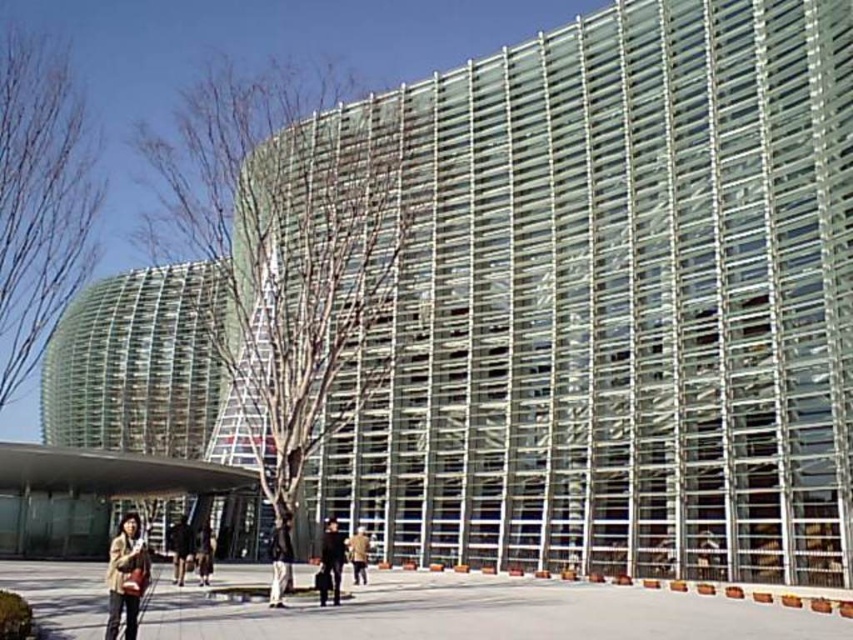
Does matte brown jacket at lower left appear over tan leather jacket at center?

Yes, matte brown jacket at lower left is above tan leather jacket at center.

How much distance is there between matte brown jacket at lower left and tan leather jacket at center?

They are 41.75 feet apart.

Measure the distance between matte brown jacket at lower left and camera.

The distance of matte brown jacket at lower left from camera is 32.52 feet.

This screenshot has height=640, width=853. Find the location of `matte brown jacket at lower left`. matte brown jacket at lower left is located at coordinates (126, 577).

Can you confirm if green leafless tree at center is positioned to the right of matte brown jacket at lower left?

No, green leafless tree at center is not to the right of matte brown jacket at lower left.

Is point (318, 200) positioned behind point (148, 573)?

Yes, it is.

Between point (285, 209) and point (131, 515), which one is positioned behind?

Point (131, 515)

Identify the location of green leafless tree at center. (286, 252).

Looking at this image, measure the distance from green leafless tree at center to dark gray fabric pants at center.

green leafless tree at center is 30.69 meters from dark gray fabric pants at center.

Between green leafless tree at center and dark gray fabric pants at center, which one is positioned higher?

green leafless tree at center

Who is more distant from viewer, (337,369) or (280,605)?

Positioned behind is point (337,369).

Identify the location of green leafless tree at center. This screenshot has height=640, width=853. (286, 252).